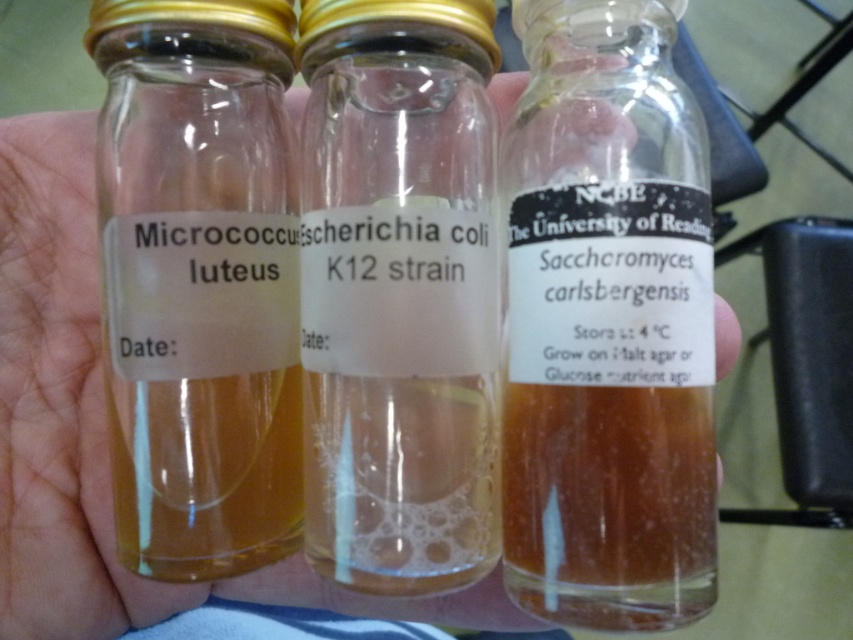
Where is `transparent glass bottle at center`? transparent glass bottle at center is located at coordinates (607, 324).

Who is shorter, transparent glass bottle at center or translucent glass vial at center?

With less height is translucent glass vial at center.

Measure the distance between transparent glass bottle at center and camera.

transparent glass bottle at center is 21.96 inches away from camera.

Identify the location of transparent glass bottle at center. Image resolution: width=853 pixels, height=640 pixels. (607, 324).

Is translucent glass vial at center to the right of clear glass vials at center from the viewer's perspective?

Indeed, translucent glass vial at center is positioned on the right side of clear glass vials at center.

Find the location of a particular element. translucent glass vial at center is located at coordinates (399, 292).

The width and height of the screenshot is (853, 640). Identify the location of translucent glass vial at center. (399, 292).

Can you confirm if translucent glass vial at center is positioned below translucent glass bottle at left?

Yes, translucent glass vial at center is below translucent glass bottle at left.

Who is shorter, translucent glass vial at center or translucent glass bottle at left?

Standing shorter between the two is translucent glass vial at center.

This screenshot has height=640, width=853. Identify the location of translucent glass vial at center. (399, 292).